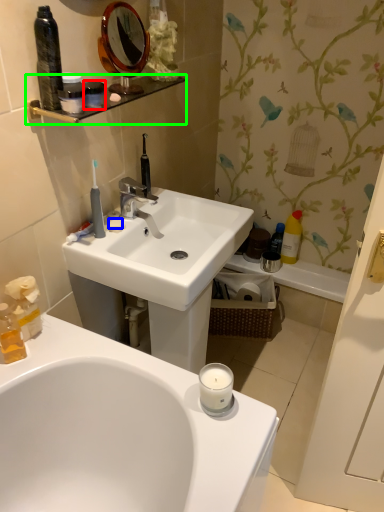
Question: Which is farther away from mouthwash (highlighted by a red box)? soap (highlighted by a blue box) or balustrade (highlighted by a green box)?

Choices:
 (A) soap
 (B) balustrade

Answer: (A)